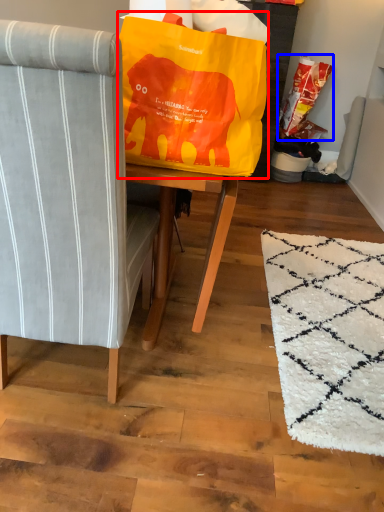
Question: Which of the following is the farthest to the observer, bean bag chair (highlighted by a red box) or grocery bag (highlighted by a blue box)?

Choices:
 (A) bean bag chair
 (B) grocery bag

Answer: (B)